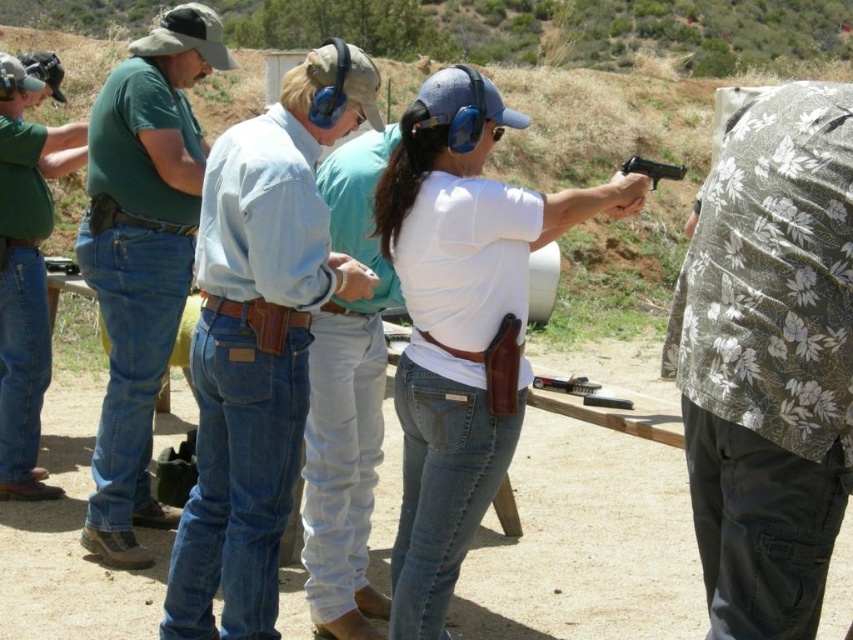
The height and width of the screenshot is (640, 853). What do you see at coordinates (769, 358) in the screenshot?
I see `floral fabric shirt at right` at bounding box center [769, 358].

Based on the photo, does floral fabric shirt at right lie behind black plastic handgun at center?

No, it is in front of black plastic handgun at center.

Between point (666, 355) and point (654, 172), which one is positioned behind?

The point (654, 172) is behind.

Locate an element on the screen. The width and height of the screenshot is (853, 640). floral fabric shirt at right is located at coordinates (769, 358).

Find the location of a particular element. This screenshot has width=853, height=640. floral fabric shirt at right is located at coordinates (769, 358).

Between point (849, 436) and point (16, 224), which one is positioned in front?

Point (849, 436)

Find the location of `floral fabric shirt at right`. floral fabric shirt at right is located at coordinates (769, 358).

Between white matte shirt at center and brushed metal water at left, which one appears on the left side from the viewer's perspective?

brushed metal water at left is more to the left.

Between white matte shirt at center and brushed metal water at left, which one has less height?

With less height is white matte shirt at center.

Is point (439, 173) positioned after point (61, 161)?

No, it is in front of (61, 161).

At what (x,y) coordinates should I click in order to perform the action: click on white matte shirt at center. Please return your answer as a coordinate pair (x, y). Looking at the image, I should click on (460, 321).